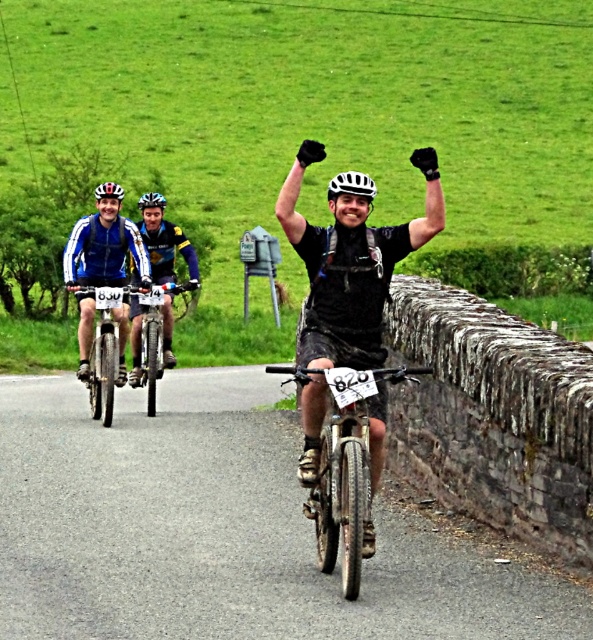
You are a photographer positioned at the starting line of the race. You want to capture a photo of both the metallic silver bicycle at center and the matte black bicycle at left in your frame. Based on their positions, which bicycle should you focus on first to ensure both are in the photo?

The metallic silver bicycle at center is positioned under the matte black bicycle at left, so you should focus on the matte black bicycle at left first to ensure both are in the photo.

You are a photographer positioned at the finish line of the race. You need to capture a photo that includes both the blue fabric jacket at left and the matte black bicycle at center. Based on their heights, will the jacket be fully visible in the photo without being blocked by the bicycle?

The blue fabric jacket at left has a lesser height compared to matte black bicycle at center, so the jacket might be partially blocked by the bicycle in the photo. Ensure the bicycle is positioned so it doesn not obscure the jacket.